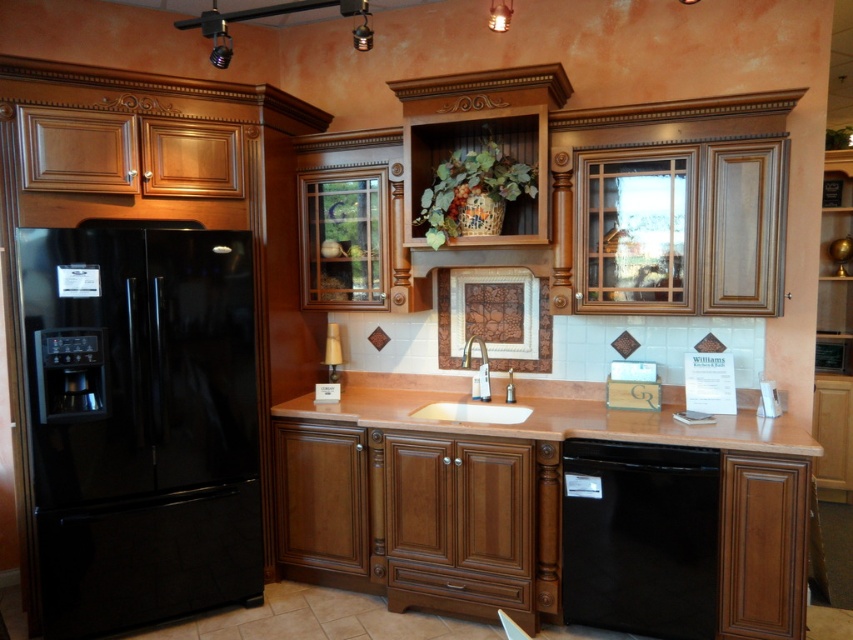
Which is more to the right, black matte dishwasher at lower center or brown polished countertop at center?

black matte dishwasher at lower center

Who is more distant from viewer, (682, 600) or (733, 435)?

Point (682, 600)

Which is in front, point (682, 545) or point (498, 404)?

Point (682, 545) is in front.

Locate an element on the screen. black matte dishwasher at lower center is located at coordinates (640, 538).

Between point (192, 540) and point (300, 413), which one is positioned behind?

Point (300, 413)

How far apart are black glossy refrigerator at left and brown polished countertop at center?

The distance of black glossy refrigerator at left from brown polished countertop at center is 36.29 inches.

Between point (202, 440) and point (358, 388), which one is positioned behind?

Positioned behind is point (358, 388).

The image size is (853, 640). I want to click on black glossy refrigerator at left, so click(140, 422).

Between black glossy refrigerator at left and white ceramic sink at center, which one has less height?

With less height is white ceramic sink at center.

Where is `black glossy refrigerator at left`? black glossy refrigerator at left is located at coordinates (140, 422).